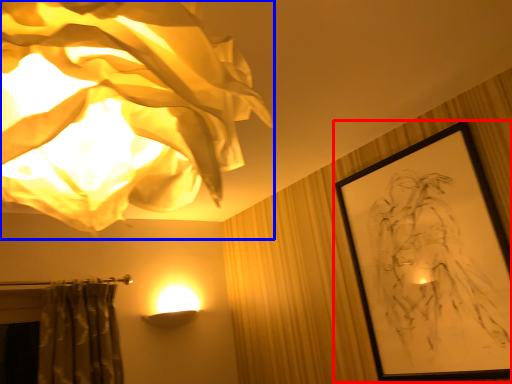
Question: Which point is closer to the camera, picture frame (highlighted by a red box) or lamp (highlighted by a blue box)?

Choices:
 (A) picture frame
 (B) lamp

Answer: (B)